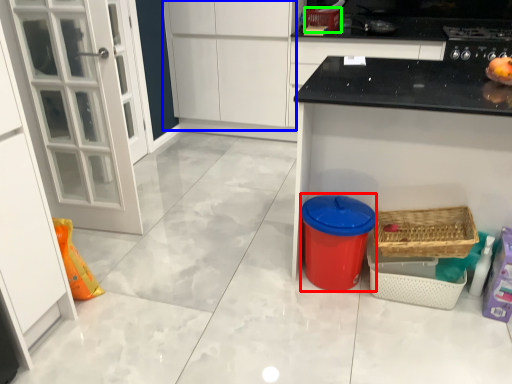
Question: Estimate the real-world distances between objects in this image. Which object is closer to appliance (highlighted by a red box), cabinetry (highlighted by a blue box) or basket (highlighted by a green box)?

Choices:
 (A) cabinetry
 (B) basket

Answer: (A)